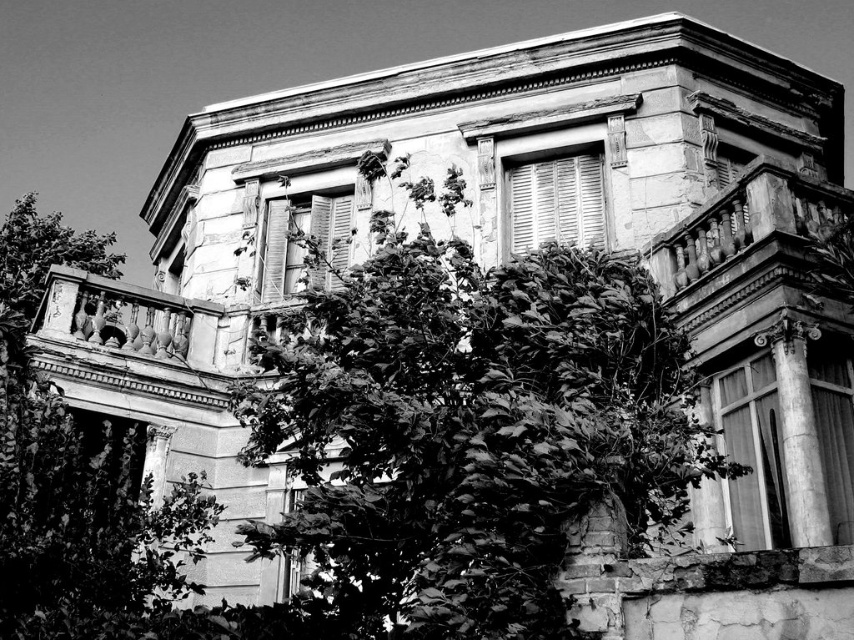
You are a photographer trying to capture the old building in the background. You notice two trees blocking the view slightly. The trees are the dark green leafy tree at center and the leaves green textured tree at left. Which tree has a narrower trunk?

The dark green leafy tree at center is thinner than the leaves green textured tree at left, so the dark green leafy tree at center has a narrower trunk.

You are a photographer trying to capture the old building in the background. You notice two trees blocking the view. Which tree, the dark green leafy tree at center or the leaves green textured tree at left, is closer to you and might be more obstructive?

The dark green leafy tree at center is in front of the leaves green textured tree at left, so it is closer and more obstructive.